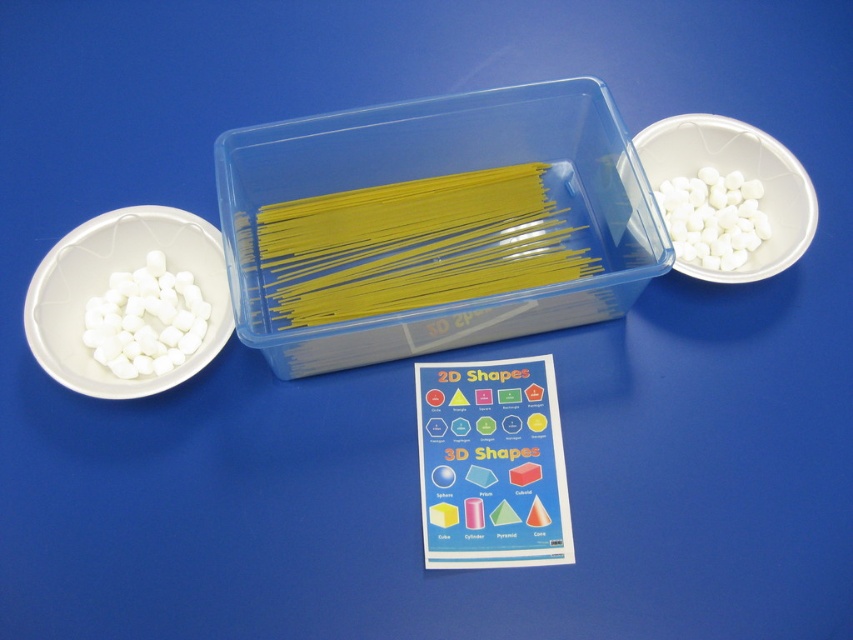
What do you see at coordinates (105, 285) in the screenshot? I see `white matte bowl at left` at bounding box center [105, 285].

Which is below, white matte bowl at left or white matte marshmallows at left?

white matte marshmallows at left is lower down.

Between point (138, 259) and point (157, 269), which one is positioned behind?

The point (138, 259) is more distant.

Find the location of a particular element. This screenshot has height=640, width=853. white matte bowl at left is located at coordinates (105, 285).

Who is more forward, (476,256) or (726,228)?

Point (476,256) is more forward.

Who is positioned more to the left, transparent plastic container at center or white matte marshmallows at right?

From the viewer's perspective, transparent plastic container at center appears more on the left side.

Between point (254, 252) and point (732, 209), which one is positioned behind?

The point (732, 209) is behind.

Where is `transparent plastic container at center`? This screenshot has width=853, height=640. transparent plastic container at center is located at coordinates (434, 225).

Can you confirm if transparent plastic container at center is shorter than white matte marshmallows at left?

Incorrect, transparent plastic container at center's height does not fall short of white matte marshmallows at left's.

Is transparent plastic container at center smaller than white matte marshmallows at left?

No, transparent plastic container at center is not smaller than white matte marshmallows at left.

Which is behind, point (392, 332) or point (165, 296)?

Positioned behind is point (165, 296).

In order to click on transparent plastic container at center in this screenshot , I will do `click(434, 225)`.